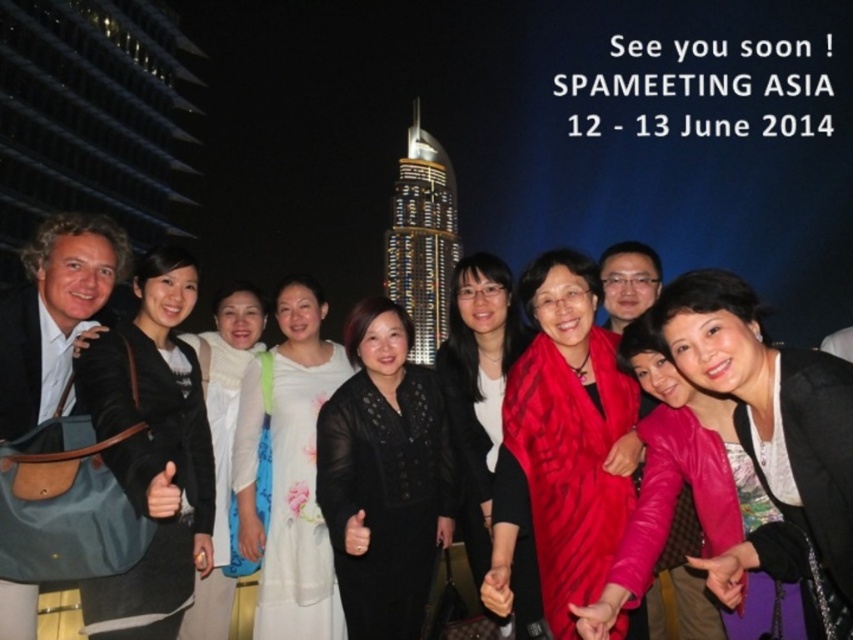
Question: Is pink leather jacket at center above matte black jacket at left?

Choices:
 (A) yes
 (B) no

Answer: (B)

Question: Is red silk scarf at center thinner than white floral dress at center?

Choices:
 (A) yes
 (B) no

Answer: (B)

Question: Which point is farther to the camera?

Choices:
 (A) (695, 289)
 (B) (553, 593)

Answer: (B)

Question: Which object appears farthest from the camera in this image?

Choices:
 (A) white floral dress at center
 (B) matte black jacket at left
 (C) black sheer dress at center

Answer: (A)

Question: Which of the following is the farthest from the observer?

Choices:
 (A) red silk scarf at center
 (B) matte black jacket at left
 (C) pink leather jacket at center
 (D) black sheer dress at center

Answer: (D)

Question: Does red silk scarf at center lie in front of matte black jacket at left?

Choices:
 (A) yes
 (B) no

Answer: (B)